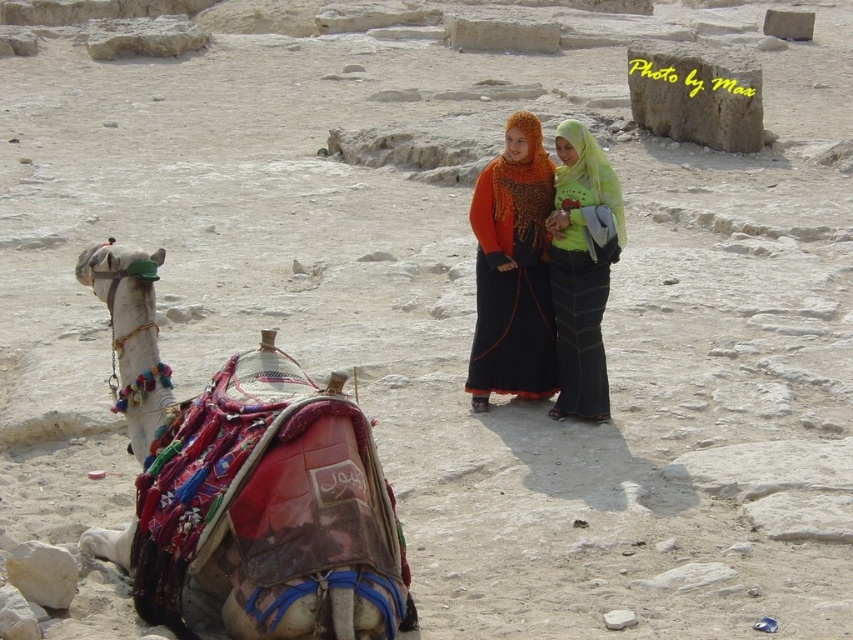
Question: Which object is the closest to the green fabric hijab at center?

Choices:
 (A) orange knitted scarf at center
 (B) decorative fabric camel at left

Answer: (A)

Question: Is orange knitted scarf at center below green fabric hijab at center?

Choices:
 (A) yes
 (B) no

Answer: (B)

Question: Is decorative fabric camel at left below green fabric hijab at center?

Choices:
 (A) yes
 (B) no

Answer: (A)

Question: Does decorative fabric camel at left appear under green fabric hijab at center?

Choices:
 (A) no
 (B) yes

Answer: (B)

Question: Which point is farther to the camera?

Choices:
 (A) (505, 140)
 (B) (381, 605)
 (C) (584, 220)

Answer: (A)

Question: Which point is farther from the camera taking this photo?

Choices:
 (A) (381, 497)
 (B) (590, 392)
 (C) (506, 371)

Answer: (C)